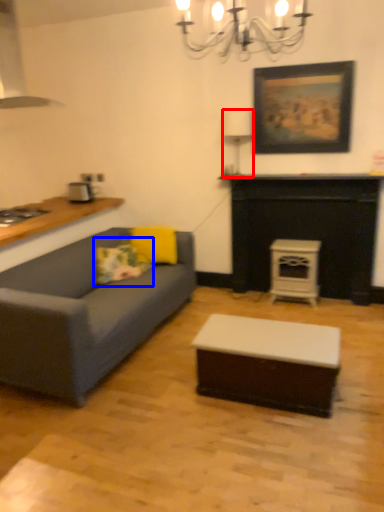
Question: Which point is closer to the camera, lamp (highlighted by a red box) or pillow (highlighted by a blue box)?

Choices:
 (A) lamp
 (B) pillow

Answer: (B)